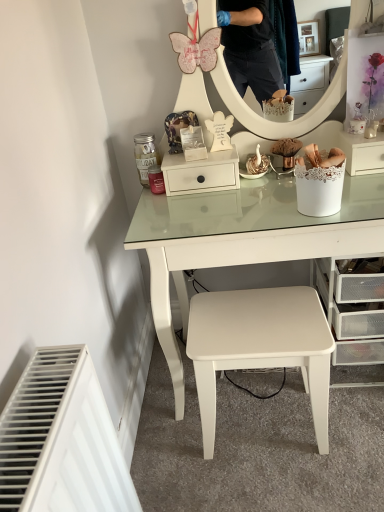
Question: Is white lace-covered basket at right, which is the 1th shelf in right-to-left order, thinner than white matte stool at center?

Choices:
 (A) yes
 (B) no

Answer: (A)

Question: Can you confirm if white lace-covered basket at right, which is the 1th shelf in right-to-left order, is smaller than white matte stool at center?

Choices:
 (A) yes
 (B) no

Answer: (A)

Question: Is white lace-covered basket at right, arranged as the second shelf when viewed from the left, next to white matte stool at center?

Choices:
 (A) no
 (B) yes

Answer: (A)

Question: From the image's perspective, is white lace-covered basket at right, which is the 1th shelf in right-to-left order, on white matte stool at center?

Choices:
 (A) no
 (B) yes

Answer: (B)

Question: Is white lace-covered basket at right, arranged as the second shelf when viewed from the left, shorter than white matte stool at center?

Choices:
 (A) yes
 (B) no

Answer: (A)

Question: From a real-world perspective, is white matte drawer at center, positioned as the 1th shelf in left-to-right order, positioned above or below white matte stool at center?

Choices:
 (A) above
 (B) below

Answer: (A)

Question: Is white matte drawer at center, placed as the second shelf when sorted from right to left, taller or shorter than white matte stool at center?

Choices:
 (A) short
 (B) tall

Answer: (A)

Question: In terms of width, does white matte drawer at center, positioned as the 1th shelf in left-to-right order, look wider or thinner when compared to white matte stool at center?

Choices:
 (A) thin
 (B) wide

Answer: (A)

Question: Relative to white matte stool at center, is white matte drawer at center, positioned as the 1th shelf in left-to-right order, in front or behind?

Choices:
 (A) behind
 (B) front

Answer: (A)

Question: From a real-world perspective, is white matte stool at center above or below white matte drawer at center, placed as the second shelf when sorted from right to left?

Choices:
 (A) below
 (B) above

Answer: (A)

Question: Looking at the image, does white matte stool at center seem bigger or smaller compared to white matte drawer at center, positioned as the 1th shelf in left-to-right order?

Choices:
 (A) small
 (B) big

Answer: (B)

Question: From their relative heights in the image, would you say white matte stool at center is taller or shorter than white matte drawer at center, positioned as the 1th shelf in left-to-right order?

Choices:
 (A) tall
 (B) short

Answer: (A)

Question: Considering their positions, is white matte stool at center located in front of or behind white matte drawer at center, placed as the second shelf when sorted from right to left?

Choices:
 (A) behind
 (B) front

Answer: (B)

Question: Is white lace-covered basket at right, which is the 1th shelf in right-to-left order, spatially inside white matte drawer at center, positioned as the 1th shelf in left-to-right order, or outside of it?

Choices:
 (A) outside
 (B) inside

Answer: (A)

Question: From the image's perspective, is white lace-covered basket at right, arranged as the second shelf when viewed from the left, positioned above or below white matte drawer at center, placed as the second shelf when sorted from right to left?

Choices:
 (A) above
 (B) below

Answer: (A)